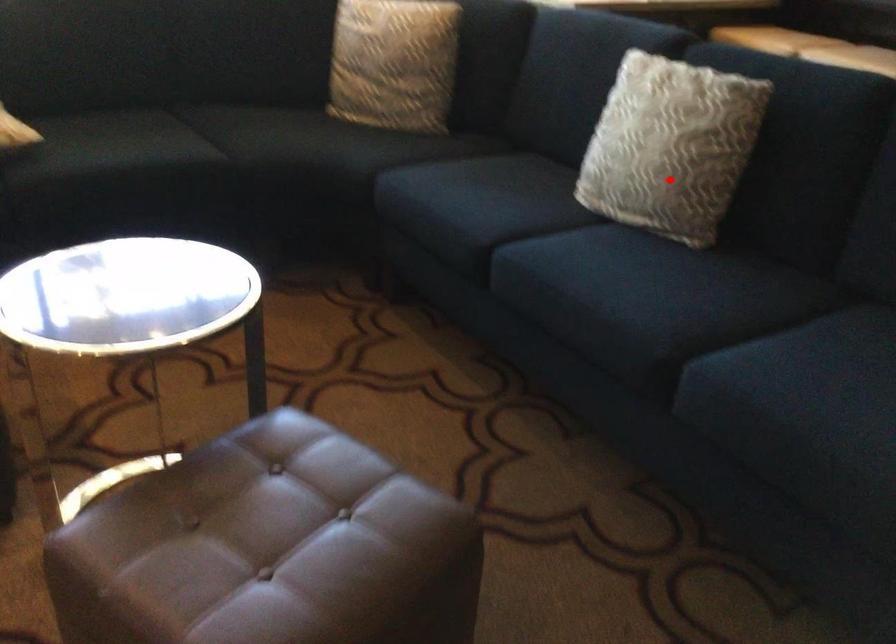
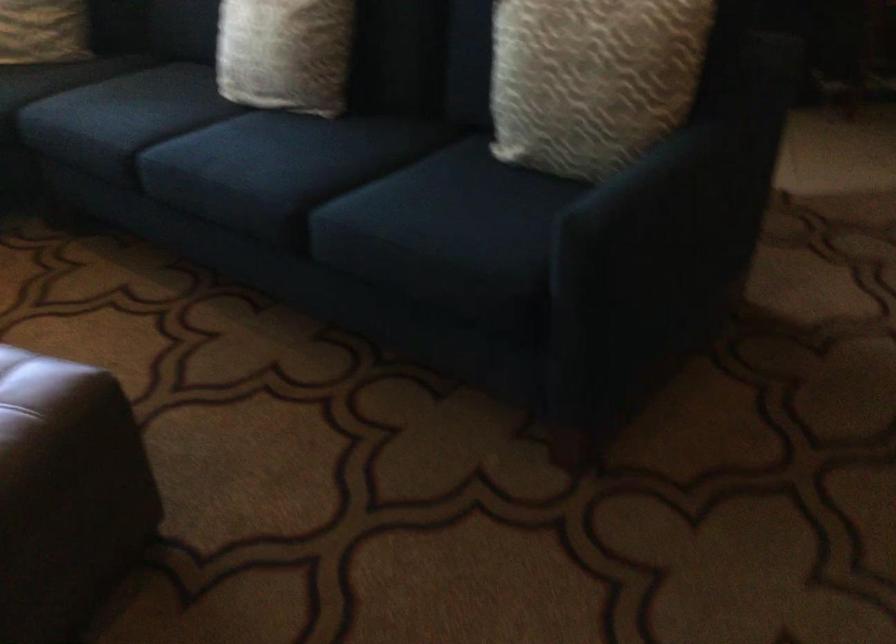
Where in the second image is the point corresponding to the highlighted location from the first image?

(285, 53)